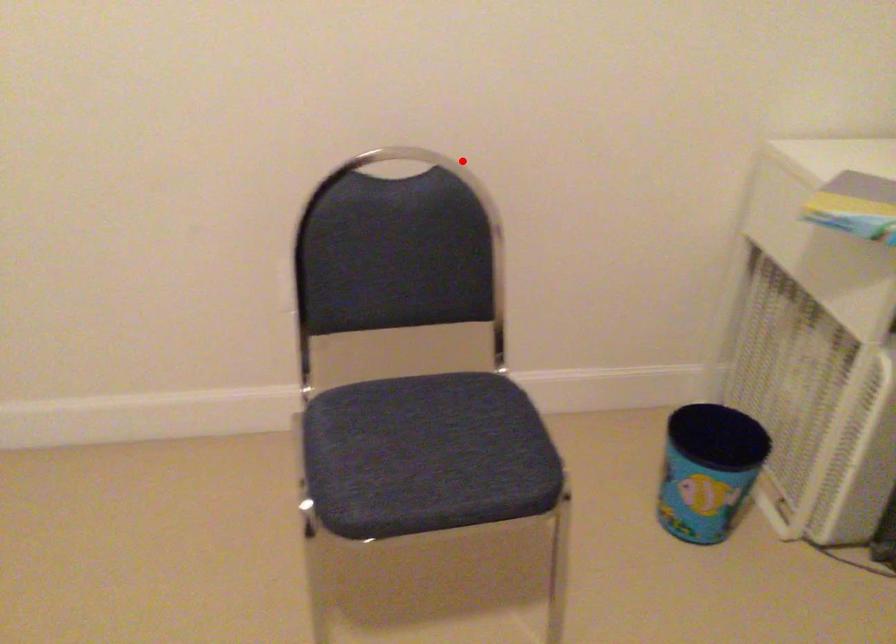
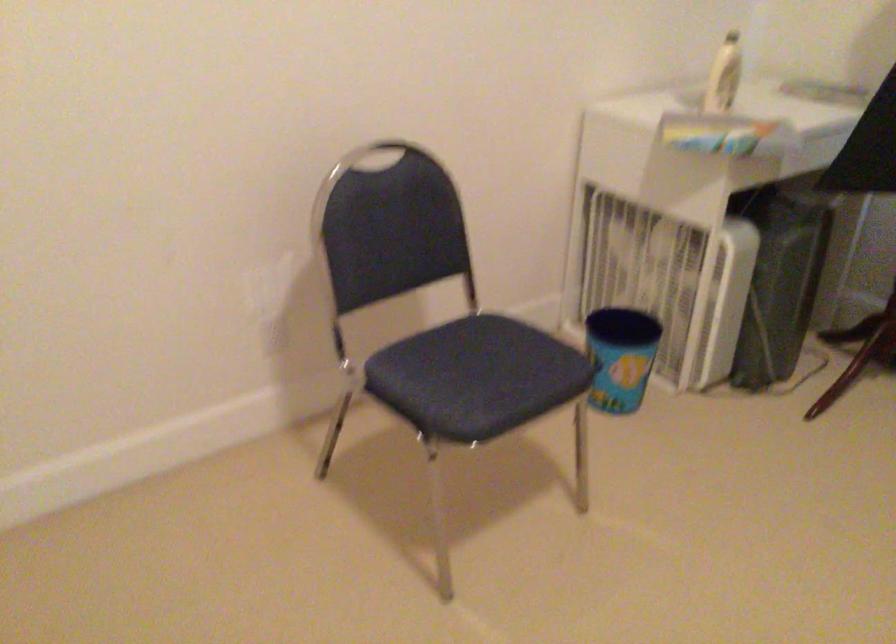
In the second image, find the point that corresponds to the highlighted location in the first image.

(377, 156)